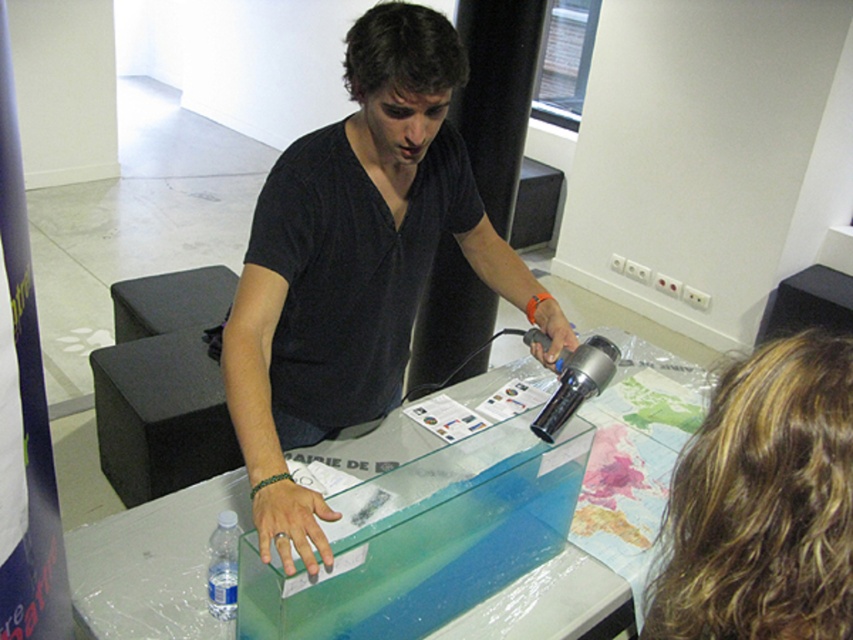
Who is more distant from viewer, (241, 435) or (236, 572)?

Point (241, 435)

Does point (386, 355) come in front of point (207, 580)?

No, it is not.

Does point (279, 365) come in front of point (221, 588)?

No.

The height and width of the screenshot is (640, 853). I want to click on black matte shirt at center, so click(357, 266).

Is transparent glass table at center closer to camera compared to black matte shirt at center?

No, transparent glass table at center is further to the viewer.

Between transparent glass table at center and black matte shirt at center, which one appears on the right side from the viewer's perspective?

transparent glass table at center

Describe the element at coordinates (379, 547) in the screenshot. I see `transparent glass table at center` at that location.

This screenshot has height=640, width=853. I want to click on transparent glass table at center, so click(x=379, y=547).

Does transparent glass table at center appear on the left side of transparent plastic bottle at lower left?

Incorrect, transparent glass table at center is not on the left side of transparent plastic bottle at lower left.

Identify the location of transparent glass table at center. (379, 547).

Is point (132, 632) farther from camera compared to point (209, 540)?

No, (132, 632) is in front of (209, 540).

You are a GUI agent. You are given a task and a screenshot of the screen. Output one action in this format:
    pyautogui.click(x=<x>, y=<y>)
    Task: Click on the transparent glass table at center
    
    Given the screenshot: What is the action you would take?
    pyautogui.click(x=379, y=547)